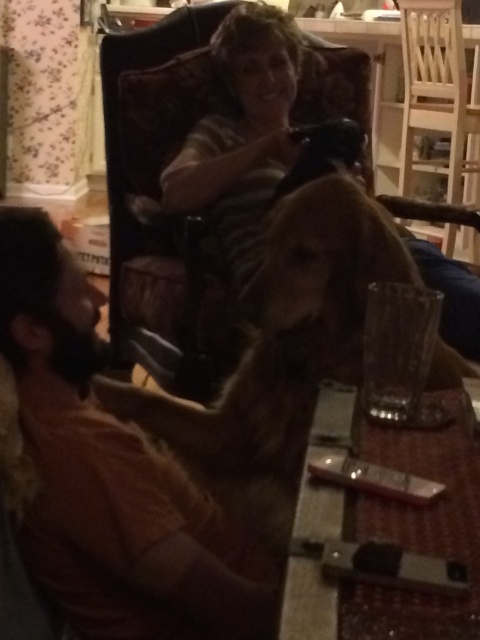
Question: Which object appears closest to the camera in this image?

Choices:
 (A) striped shirt at upper center
 (B) fuzzy brown dog at center
 (C) brown fuzzy sweater at left

Answer: (C)

Question: Observing the image, what is the correct spatial positioning of fuzzy brown dog at center in reference to striped shirt at upper center?

Choices:
 (A) below
 (B) above

Answer: (A)

Question: Which point appears closest to the camera in this image?

Choices:
 (A) (245, 28)
 (B) (441, 490)

Answer: (B)

Question: Which of the following is the closest to the observer?

Choices:
 (A) (475, 120)
 (B) (83, 577)

Answer: (B)

Question: Does fuzzy brown dog at center have a greater width compared to wooden chair at upper right?

Choices:
 (A) no
 (B) yes

Answer: (B)

Question: In this image, where is brown fuzzy sweater at left located relative to metallic silver remote at center?

Choices:
 (A) below
 (B) above

Answer: (B)